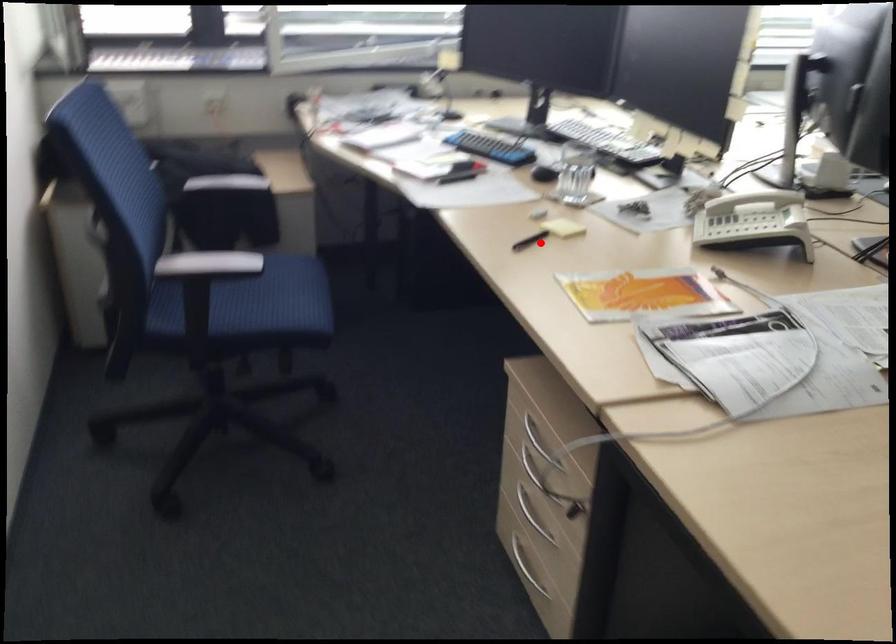
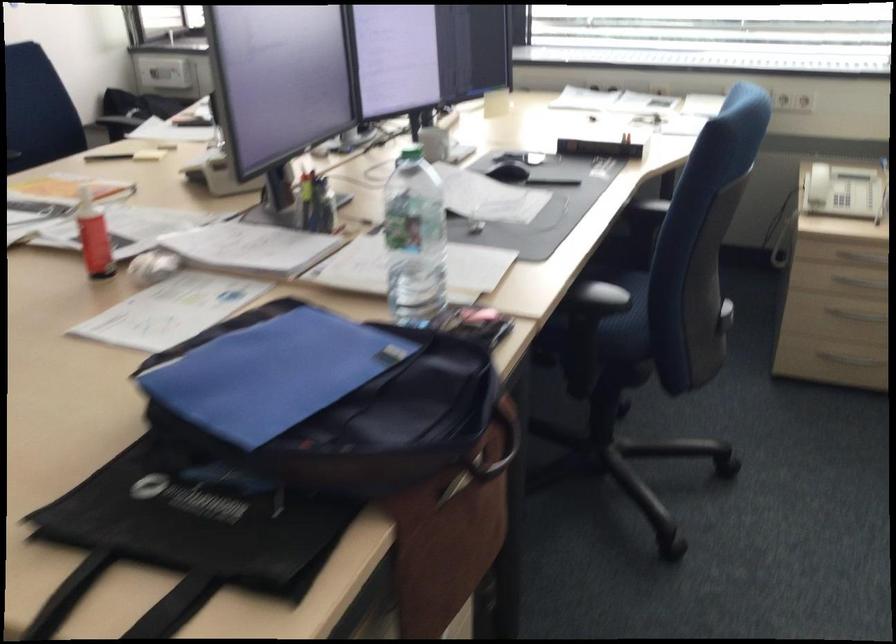
Locate, in the second image, the point that corresponds to the highlighted location in the first image.

(108, 156)